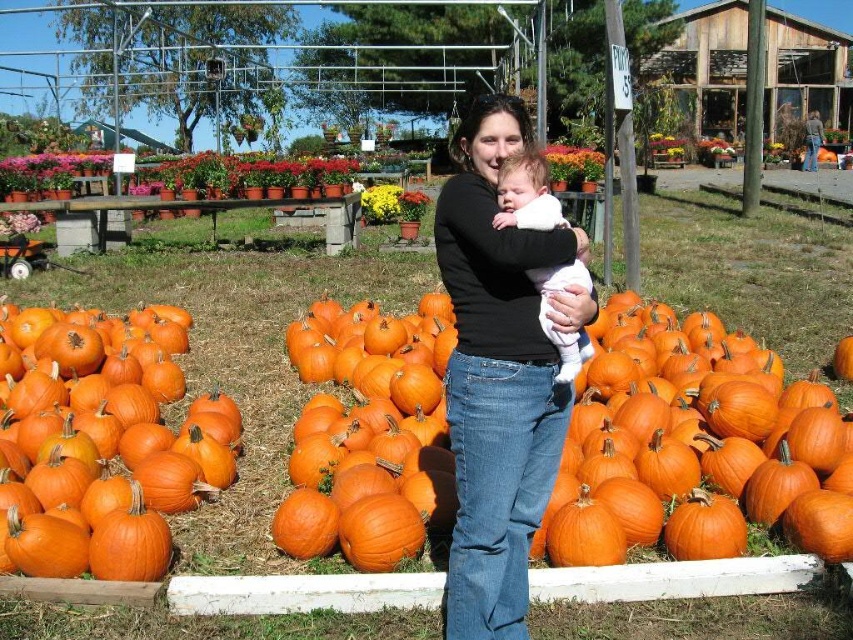
Question: Which point is farther from the camera taking this photo?

Choices:
 (A) [155, 339]
 (B) [567, 372]
 (C) [463, 365]

Answer: (A)

Question: Does orange matte pumpkin at left come in front of black matte shirt at center?

Choices:
 (A) no
 (B) yes

Answer: (A)

Question: Is orange matte pumpkin at left wider than white soft baby at center?

Choices:
 (A) yes
 (B) no

Answer: (A)

Question: Estimate the real-world distances between objects in this image. Which object is closer to the white soft baby at center?

Choices:
 (A) orange matte pumpkin at left
 (B) black matte shirt at center

Answer: (B)

Question: From the image, what is the correct spatial relationship of orange matte pumpkin at left in relation to black matte shirt at center?

Choices:
 (A) above
 (B) below

Answer: (B)

Question: Which point is closer to the camera?

Choices:
 (A) coord(483,397)
 (B) coord(575,260)

Answer: (A)